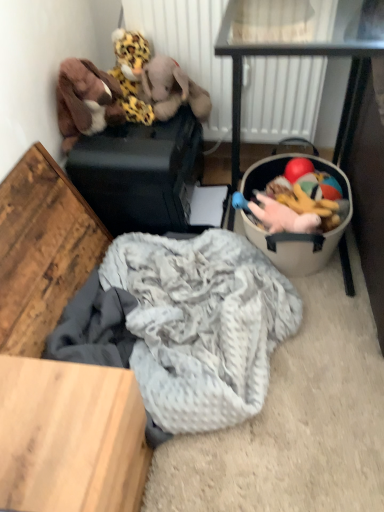
Question: Does fluffy leopard print plush at upper left, placed as the second toy when sorted from bottom to top, have a lesser width compared to wooden table at lower left?

Choices:
 (A) no
 (B) yes

Answer: (B)

Question: Considering the relative sizes of fluffy leopard print plush at upper left, the first toy when ordered from top to bottom, and wooden table at lower left in the image provided, is fluffy leopard print plush at upper left, the first toy when ordered from top to bottom, smaller than wooden table at lower left?

Choices:
 (A) yes
 (B) no

Answer: (A)

Question: From the image's perspective, is fluffy leopard print plush at upper left, placed as the second toy when sorted from bottom to top, located beneath wooden table at lower left?

Choices:
 (A) no
 (B) yes

Answer: (A)

Question: Is the depth of fluffy leopard print plush at upper left, placed as the second toy when sorted from bottom to top, less than that of wooden table at lower left?

Choices:
 (A) no
 (B) yes

Answer: (A)

Question: Considering the relative positions of fluffy leopard print plush at upper left, the first toy when ordered from top to bottom, and wooden table at lower left in the image provided, is fluffy leopard print plush at upper left, the first toy when ordered from top to bottom, behind wooden table at lower left?

Choices:
 (A) yes
 (B) no

Answer: (A)

Question: Considering the relative sizes of fluffy leopard print plush at upper left, placed as the second toy when sorted from bottom to top, and wooden table at lower left in the image provided, is fluffy leopard print plush at upper left, placed as the second toy when sorted from bottom to top, taller than wooden table at lower left?

Choices:
 (A) no
 (B) yes

Answer: (A)

Question: From a real-world perspective, is metallic black table at right located beneath fluffy plush toys at right?

Choices:
 (A) no
 (B) yes

Answer: (A)

Question: Is metallic black table at right with fluffy plush toys at right?

Choices:
 (A) no
 (B) yes

Answer: (A)

Question: Can you confirm if metallic black table at right is shorter than fluffy plush toys at right?

Choices:
 (A) no
 (B) yes

Answer: (A)

Question: Is metallic black table at right looking in the opposite direction of fluffy plush toys at right?

Choices:
 (A) yes
 (B) no

Answer: (B)

Question: From a real-world perspective, does metallic black table at right stand above fluffy plush toys at right?

Choices:
 (A) yes
 (B) no

Answer: (A)

Question: Does metallic black table at right have a lesser width compared to fluffy plush toys at right?

Choices:
 (A) no
 (B) yes

Answer: (A)

Question: Can you confirm if fluffy leopard print plush at upper left, placed as the second toy when sorted from bottom to top, is wider than metallic black table at right?

Choices:
 (A) no
 (B) yes

Answer: (A)